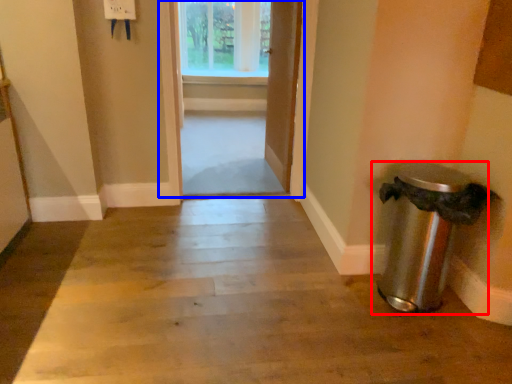
Question: Which point is closer to the camera, waste container (highlighted by a red box) or door (highlighted by a blue box)?

Choices:
 (A) waste container
 (B) door

Answer: (A)